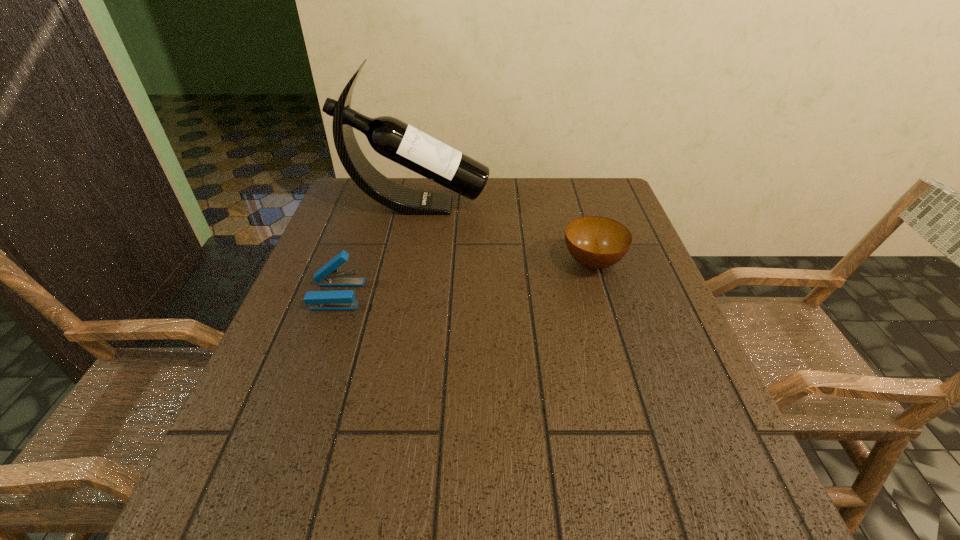
I want to click on vacant space that satisfies the following two spatial constraints: 1. on the stand of the tallest object; 2. on the right side of the rightmost object, so click(x=405, y=263).

You are a GUI agent. You are given a task and a screenshot of the screen. Output one action in this format:
    pyautogui.click(x=<x>, y=<y>)
    Task: Click on the free location that satisfies the following two spatial constraints: 1. on the stand of the rightmost object; 2. on the left side of the wine bottle
    
    Given the screenshot: What is the action you would take?
    point(405,263)

At what (x,y) coordinates should I click in order to perform the action: click on vacant space that satisfies the following two spatial constraints: 1. on the stand of the farthest object; 2. on the left side of the bowl. Please return your answer as a coordinate pair (x, y). Looking at the image, I should click on (405, 263).